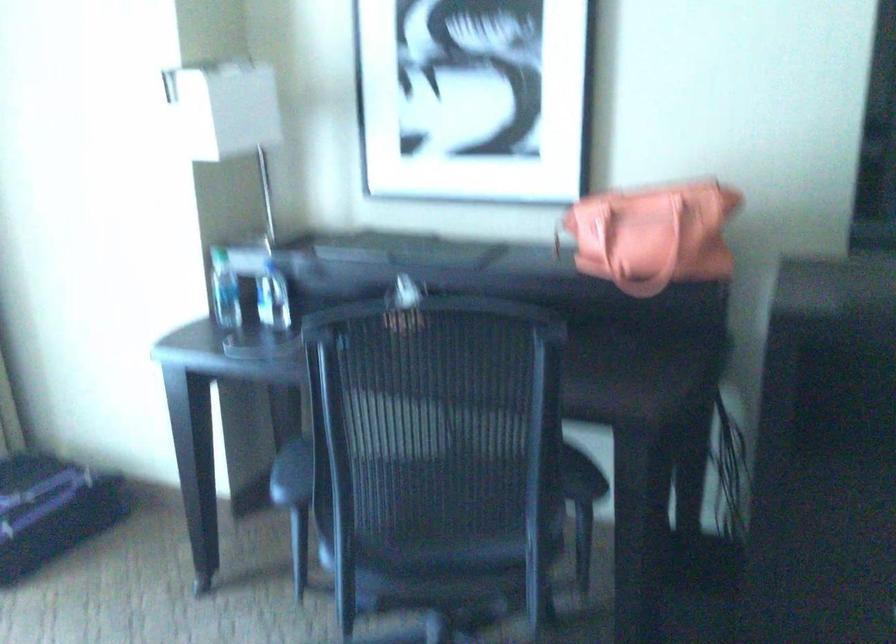
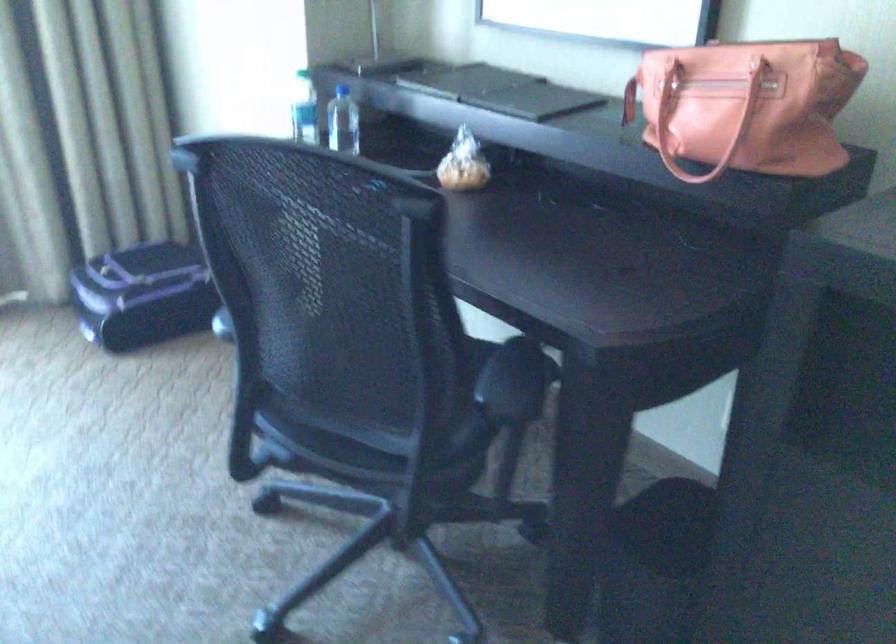
Find the pixel in the second image that matches pixel 554 236 in the first image.

(629, 100)